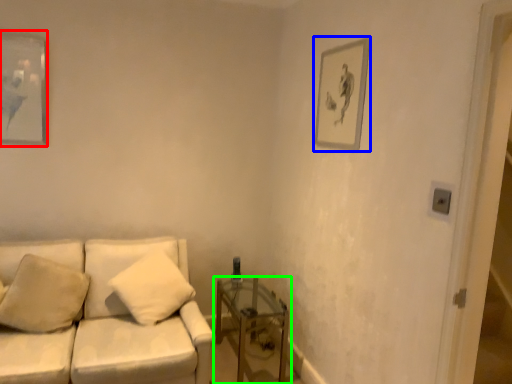
Question: Estimate the real-world distances between objects in this image. Which object is farther from picture frame (highlighted by a red box), picture frame (highlighted by a blue box) or table (highlighted by a green box)?

Choices:
 (A) picture frame
 (B) table

Answer: (A)